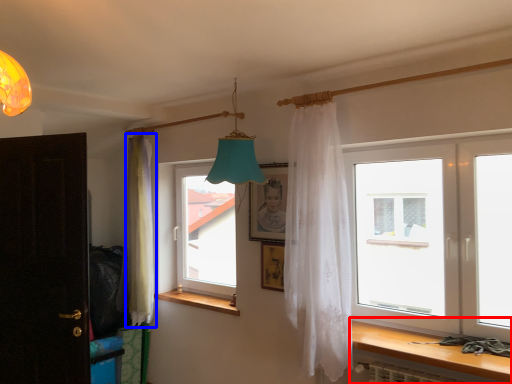
Question: Which of the following is the closest to the observer, table (highlighted by a red box) or curtain (highlighted by a blue box)?

Choices:
 (A) table
 (B) curtain

Answer: (A)